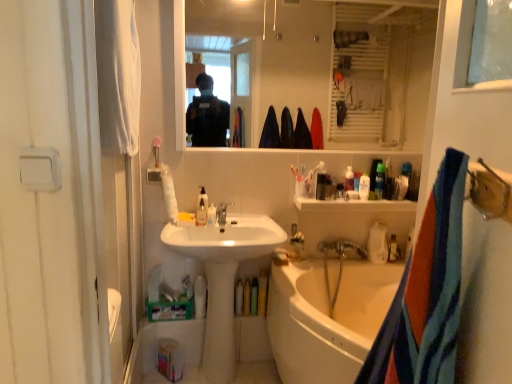
What are the coordinates of `free spot above white plastic shelf at upper center (from a real-world perspective)` in the screenshot? It's located at (359, 197).